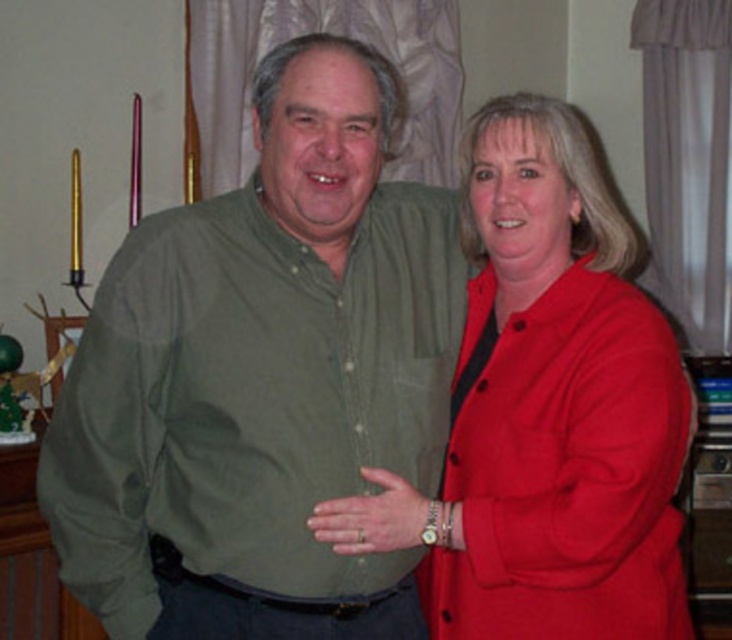
Consider the image. You are a photographer standing at the camera position. You want to adjust the focus to capture the green cotton shirt at center clearly. What is the minimum focusing distance you should set on your camera?

The minimum focusing distance should be set to at least 1.40 meters to ensure the green cotton shirt at center is in focus.

You are standing in a living room and see the green cotton shirt at center and the matte red blazer at center. Which one is positioned more to the left side?

The green cotton shirt at center is positioned more to the left side because it is to the left of the matte red blazer at center.

You are a photographer setting up a photo shoot in a studio. You have two subjects wearing the green cotton shirt at center and the matte red blazer at center. You need to position them side by side so that their clothing does not overlap. Based on the image, which subject should you place on the left to ensure there is enough space between them?

The green cotton shirt at center might be wider than matte red blazer at center, so placing the green cotton shirt at center on the left would allow more space between them to prevent overlapping.